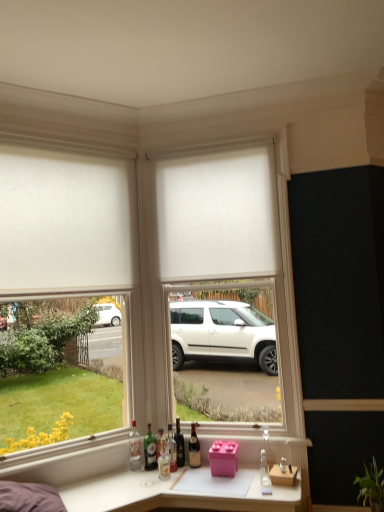
Where is `free area in between translucent glass bottle at center, which ranks as the fourth bottle in left-to-right order, and clear glass bottle at center, positioned as the seventh bottle in left-to-right order`? free area in between translucent glass bottle at center, which ranks as the fourth bottle in left-to-right order, and clear glass bottle at center, positioned as the seventh bottle in left-to-right order is located at coordinates (215, 477).